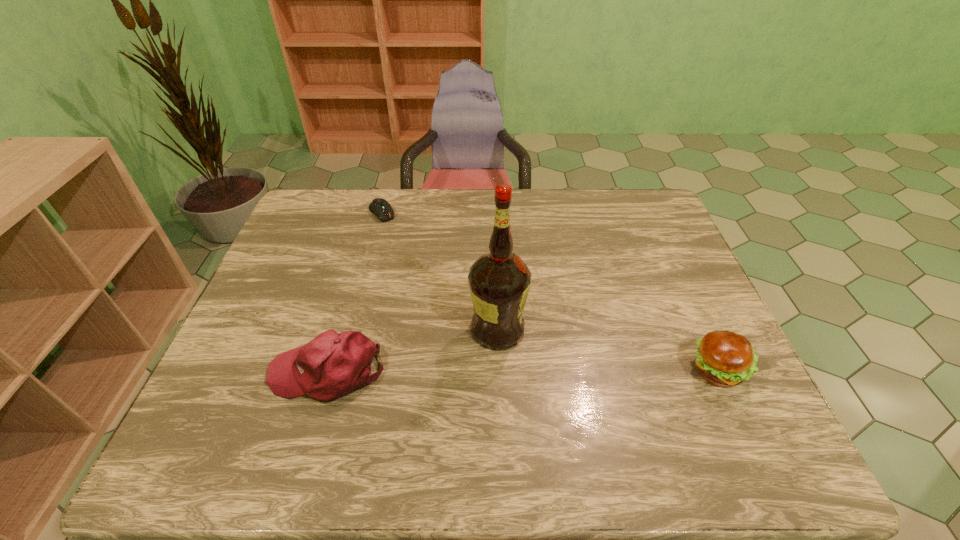
Where is `free space between the baseball cap and the second shortest object`? free space between the baseball cap and the second shortest object is located at coordinates (523, 372).

This screenshot has width=960, height=540. What are the coordinates of `vacant space that is in between the tallest object and the baseball cap` in the screenshot? It's located at (412, 351).

The image size is (960, 540). I want to click on empty space that is in between the rightmost object and the computer equipment, so click(551, 292).

Image resolution: width=960 pixels, height=540 pixels. What are the coordinates of `vacant area between the shortest object and the second object from right to left` in the screenshot? It's located at (440, 271).

Image resolution: width=960 pixels, height=540 pixels. Find the location of `unoccupied area between the baseball cap and the alcohol`. unoccupied area between the baseball cap and the alcohol is located at coordinates (412, 351).

The height and width of the screenshot is (540, 960). In order to click on vacant area between the hamburger and the baseball cap in this screenshot , I will do `click(523, 372)`.

At what (x,y) coordinates should I click in order to perform the action: click on vacant area that lies between the computer equipment and the second object from right to left. Please return your answer as a coordinate pair (x, y). Looking at the image, I should click on 440,271.

Locate which object ranks second in proximity to the tallest object. Please provide its 2D coordinates. Your answer should be formatted as a tuple, i.e. [(x, y)], where the tuple contains the x and y coordinates of a point satisfying the conditions above.

[(724, 358)]

Find the location of a particular element. This screenshot has width=960, height=540. object that ranks as the third closest to the farthest object is located at coordinates (724, 358).

The image size is (960, 540). I want to click on vacant area in the image that satisfies the following two spatial constraints: 1. on the front side of the third object from left to right; 2. on the left side of the rightmost object, so click(x=499, y=372).